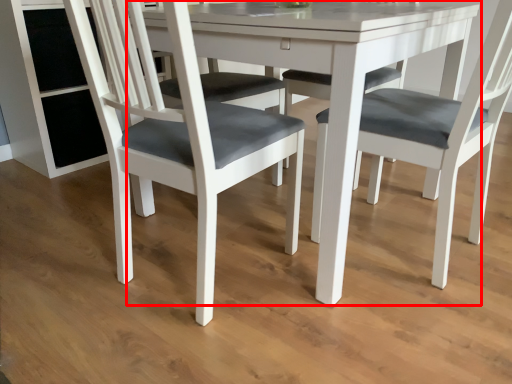
Question: Observing the image, what is the correct spatial positioning of round table (annotated by the red box) in reference to chair?

Choices:
 (A) right
 (B) left

Answer: (A)